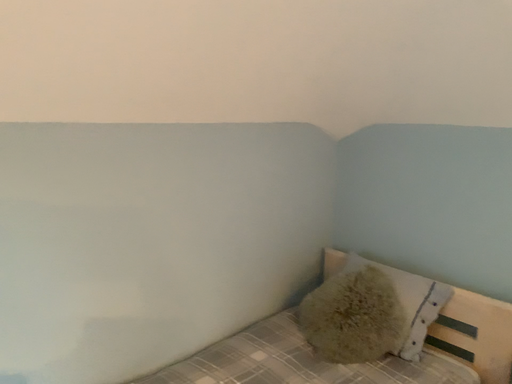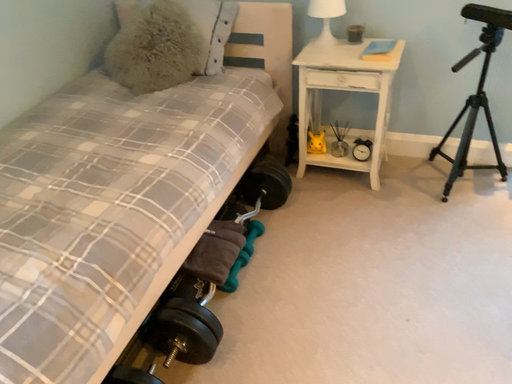
Question: How did the camera likely rotate when shooting the video?

Choices:
 (A) rotated left
 (B) rotated right

Answer: (B)